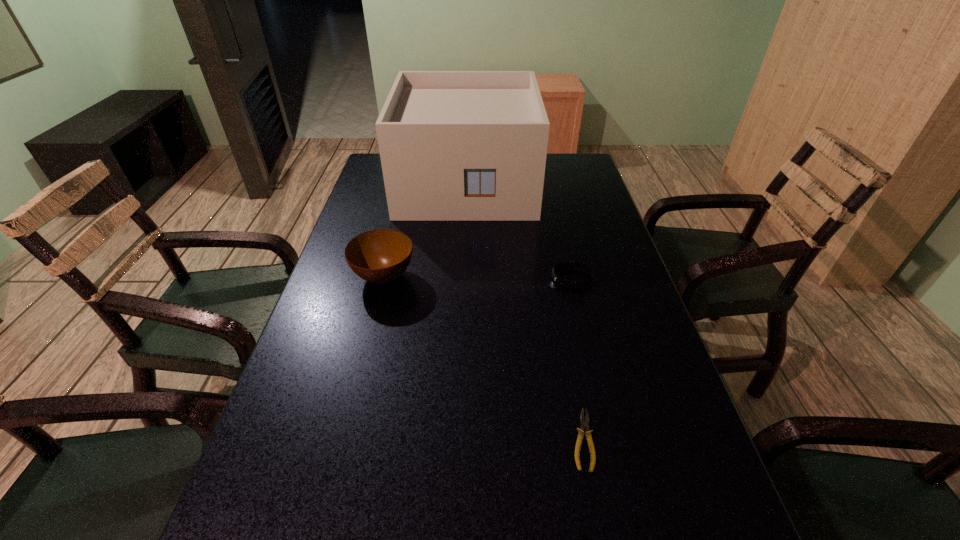
Where is `vacant area that lies between the pliers and the bowl`? The height and width of the screenshot is (540, 960). vacant area that lies between the pliers and the bowl is located at coordinates point(484,359).

I want to click on empty location between the wristband and the second tallest object, so click(478, 277).

The width and height of the screenshot is (960, 540). I want to click on free space between the farthest object and the third tallest object, so click(x=519, y=231).

Locate an element on the screen. vacant point located between the second shortest object and the second tallest object is located at coordinates [478, 277].

Locate an element on the screen. The width and height of the screenshot is (960, 540). unoccupied area between the tallest object and the third shortest object is located at coordinates (425, 230).

This screenshot has height=540, width=960. In order to click on vacant space that is in between the box and the wristband in this screenshot , I will do `click(519, 231)`.

This screenshot has height=540, width=960. What are the coordinates of `vacant space that's between the second shortest object and the bowl` in the screenshot? It's located at (478, 277).

Image resolution: width=960 pixels, height=540 pixels. What are the coordinates of `free space between the bowl and the nearest object` in the screenshot? It's located at (484, 359).

Where is `vacant area that lies between the wristband and the farthest object`? The height and width of the screenshot is (540, 960). vacant area that lies between the wristband and the farthest object is located at coordinates (519, 231).

Locate an element on the screen. The image size is (960, 540). object that can be found as the second closest to the bowl is located at coordinates (562, 282).